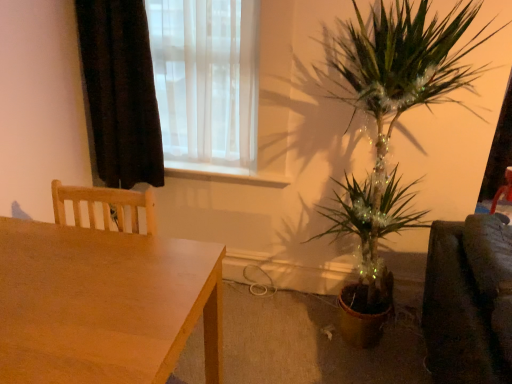
This screenshot has width=512, height=384. Find the location of `white glossy window sill at center`. white glossy window sill at center is located at coordinates (224, 174).

You are a GUI agent. You are given a task and a screenshot of the screen. Output one action in this format:
    pyautogui.click(x=<x>, y=<y>)
    Task: Click on the translucent white curtain at upper left
    The height and width of the screenshot is (384, 512).
    Given the screenshot: What is the action you would take?
    pyautogui.click(x=208, y=88)

What do you see at coordinates (103, 304) in the screenshot?
I see `wooden table at lower left` at bounding box center [103, 304].

Locate an element on the screen. The width and height of the screenshot is (512, 384). white glossy window sill at center is located at coordinates (224, 174).

Is translucent white curtain at upper left next to white glossy window sill at center and touching it?

No, translucent white curtain at upper left is not with white glossy window sill at center.

Is translucent white curtain at upper left to the right of white glossy window sill at center from the viewer's perspective?

Incorrect, translucent white curtain at upper left is not on the right side of white glossy window sill at center.

Can you confirm if translucent white curtain at upper left is smaller than white glossy window sill at center?

No.

Is translucent white curtain at upper left aimed at white glossy window sill at center?

No, translucent white curtain at upper left does not turn towards white glossy window sill at center.

Does black velvet curtain at upper left have a lesser width compared to wooden table at lower left?

Indeed, black velvet curtain at upper left has a lesser width compared to wooden table at lower left.

Which is closer to the camera, (117, 146) or (15, 290)?

Point (15, 290)

Is black velvet curtain at upper left looking in the opposite direction of wooden table at lower left?

No, black velvet curtain at upper left is not facing away from wooden table at lower left.

At what (x,y) coordinates should I click in order to perform the action: click on curtain above the wooden table at lower left (from the image's perspective). Please return your answer as a coordinate pair (x, y). The height and width of the screenshot is (384, 512). Looking at the image, I should click on (120, 91).

Can you tell me how much wooden table at lower left and translucent white curtain at upper left differ in facing direction?

wooden table at lower left and translucent white curtain at upper left are facing 89.8 degrees away from each other.

Is wooden table at lower left oriented away from translucent white curtain at upper left?

No, wooden table at lower left's orientation is not away from translucent white curtain at upper left.

At what (x,y) coordinates should I click in order to perform the action: click on window located above the wooden table at lower left (from the image's perspective). Please return your answer as a coordinate pair (x, y). Looking at the image, I should click on (208, 88).

Considering the positions of objects wooden table at lower left and translucent white curtain at upper left in the image provided, who is more to the right, wooden table at lower left or translucent white curtain at upper left?

Positioned to the right is translucent white curtain at upper left.

Is white glossy window sill at center in front of or behind black velvet curtain at upper left in the image?

Visually, white glossy window sill at center is located behind black velvet curtain at upper left.

In the scene shown: Considering the sizes of white glossy window sill at center and black velvet curtain at upper left in the image, is white glossy window sill at center wider or thinner than black velvet curtain at upper left?

In the image, white glossy window sill at center appears to be more narrow than black velvet curtain at upper left.

From a real-world perspective, relative to black velvet curtain at upper left, is white glossy window sill at center vertically above or below?

In terms of real-world spatial position, white glossy window sill at center is below black velvet curtain at upper left.

You are a GUI agent. You are given a task and a screenshot of the screen. Output one action in this format:
    pyautogui.click(x=<x>, y=<y>)
    Task: Click on the curtain located on the left of white glossy window sill at center
    The image size is (512, 384).
    Given the screenshot: What is the action you would take?
    pyautogui.click(x=120, y=91)

What's the angular difference between wooden table at lower left and white glossy window sill at center's facing directions?

The angle between the facing direction of wooden table at lower left and the facing direction of white glossy window sill at center is 92.1 degrees.

Considering the relative sizes of wooden table at lower left and white glossy window sill at center in the image provided, is wooden table at lower left bigger than white glossy window sill at center?

Correct, wooden table at lower left is larger in size than white glossy window sill at center.

From the image's perspective, does wooden table at lower left appear higher than white glossy window sill at center?

No, from the image's perspective, wooden table at lower left is not above white glossy window sill at center.

Which of these two, wooden table at lower left or white glossy window sill at center, stands shorter?

white glossy window sill at center is shorter.

Based on their positions, is translucent white curtain at upper left located to the left or right of black velvet curtain at upper left?

Based on their positions, translucent white curtain at upper left is located to the right of black velvet curtain at upper left.

Between translucent white curtain at upper left and black velvet curtain at upper left, which one has less height?

translucent white curtain at upper left.

The width and height of the screenshot is (512, 384). Find the location of `curtain located below the translucent white curtain at upper left (from the image's perspective)`. curtain located below the translucent white curtain at upper left (from the image's perspective) is located at coordinates (120, 91).

From a real-world perspective, relative to black velvet curtain at upper left, is translucent white curtain at upper left vertically above or below?

translucent white curtain at upper left is situated higher than black velvet curtain at upper left in the real world.

Is point (205, 150) positioned before point (33, 381)?

No, it is behind (33, 381).

Can you confirm if translucent white curtain at upper left is shorter than wooden table at lower left?

Incorrect, the height of translucent white curtain at upper left does not fall short of that of wooden table at lower left.

Does translucent white curtain at upper left touch wooden table at lower left?

No, translucent white curtain at upper left is not beside wooden table at lower left.

Where is `window on the left of white glossy window sill at center`? The width and height of the screenshot is (512, 384). window on the left of white glossy window sill at center is located at coordinates click(208, 88).

The image size is (512, 384). Find the location of `curtain above the wooden table at lower left (from a real-world perspective)`. curtain above the wooden table at lower left (from a real-world perspective) is located at coordinates (120, 91).

Based on their spatial positions, is black velvet curtain at upper left or wooden table at lower left closer to white glossy window sill at center?

black velvet curtain at upper left lies closer to white glossy window sill at center than the other object.

When comparing their distances from wooden table at lower left, does white glossy window sill at center or translucent white curtain at upper left seem further?

white glossy window sill at center is positioned further to the anchor wooden table at lower left.

Estimate the real-world distances between objects in this image. Which object is further from translucent white curtain at upper left, wooden table at lower left or white glossy window sill at center?

wooden table at lower left is further to translucent white curtain at upper left.

Estimate the real-world distances between objects in this image. Which object is further from wooden table at lower left, white glossy window sill at center or black velvet curtain at upper left?

Based on the image, white glossy window sill at center appears to be further to wooden table at lower left.

Looking at the image, which one is located closer to wooden table at lower left, translucent white curtain at upper left or black velvet curtain at upper left?

black velvet curtain at upper left lies closer to wooden table at lower left than the other object.

From the image, which object appears to be farther from black velvet curtain at upper left, white glossy window sill at center or translucent white curtain at upper left?

Based on the image, white glossy window sill at center appears to be further to black velvet curtain at upper left.

Based on their spatial positions, is white glossy window sill at center or black velvet curtain at upper left closer to translucent white curtain at upper left?

black velvet curtain at upper left.

When comparing their distances from black velvet curtain at upper left, does wooden table at lower left or white glossy window sill at center seem further?

wooden table at lower left lies further to black velvet curtain at upper left than the other object.

Locate an element on the screen. The height and width of the screenshot is (384, 512). curtain that lies between translucent white curtain at upper left and wooden table at lower left from top to bottom is located at coordinates (120, 91).

Where is `curtain between translucent white curtain at upper left and white glossy window sill at center from top to bottom`? curtain between translucent white curtain at upper left and white glossy window sill at center from top to bottom is located at coordinates (120, 91).

Locate an element on the screen. Image resolution: width=512 pixels, height=384 pixels. window between wooden table at lower left and white glossy window sill at center from front to back is located at coordinates (208, 88).

You are a GUI agent. You are given a task and a screenshot of the screen. Output one action in this format:
    pyautogui.click(x=<x>, y=<y>)
    Task: Click on the curtain between wooden table at lower left and white glossy window sill at center along the z-axis
    
    Given the screenshot: What is the action you would take?
    pyautogui.click(x=120, y=91)